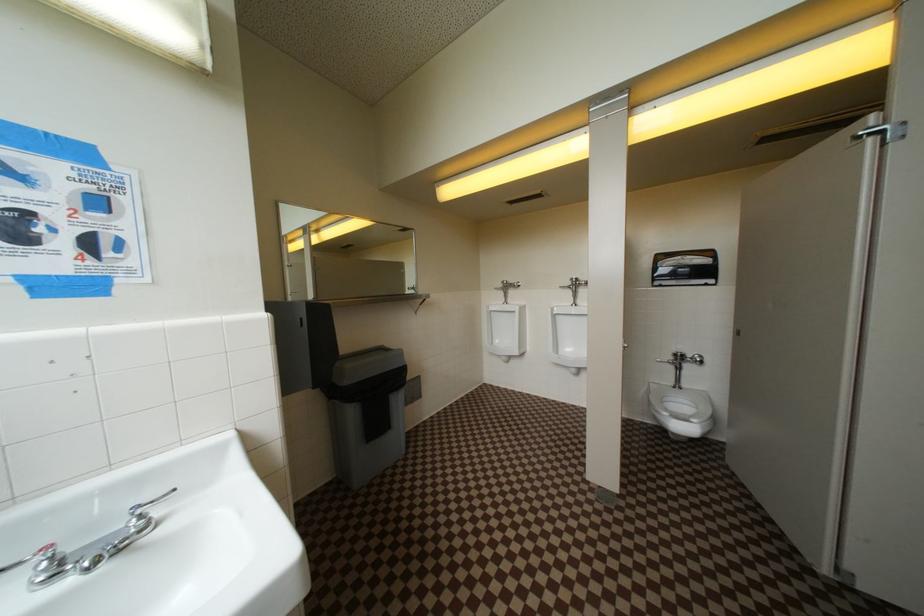
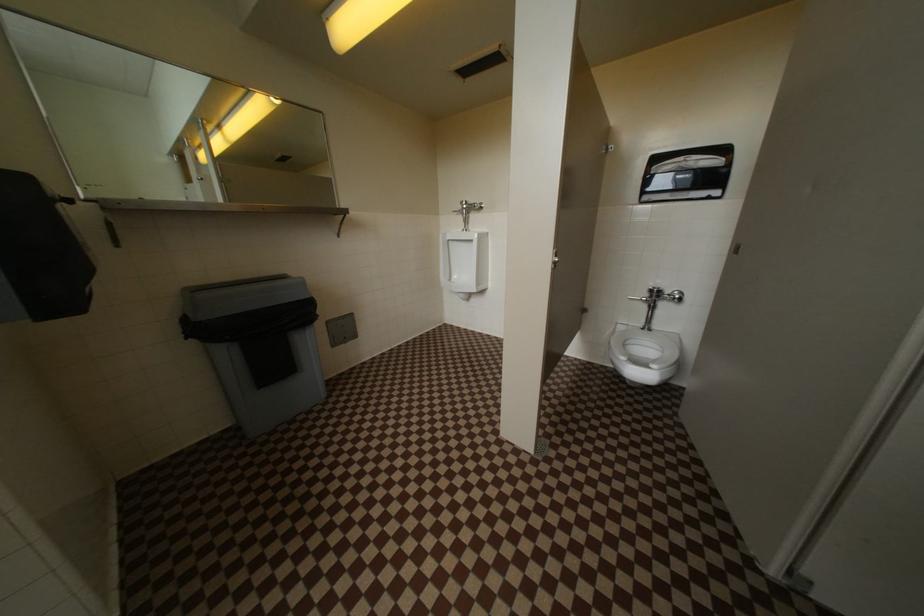
What movement of the cameraman would produce the second image?

The cameraman walked toward right, forward.